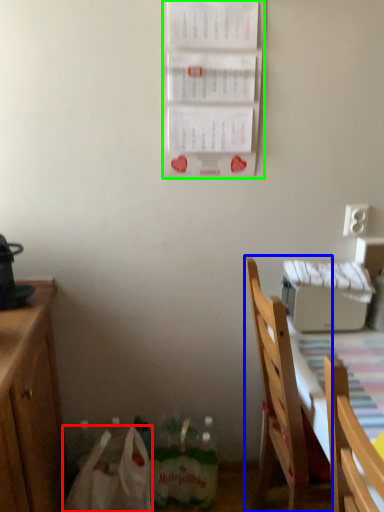
Question: Which is farther away from paper bag (highlighted by a red box)? chair (highlighted by a blue box) or bulletin board (highlighted by a green box)?

Choices:
 (A) chair
 (B) bulletin board

Answer: (B)